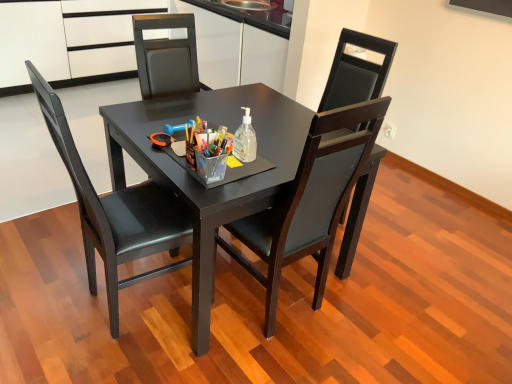
Find the location of a particular element. vacant space behind clear plastic bottle at center is located at coordinates (258, 131).